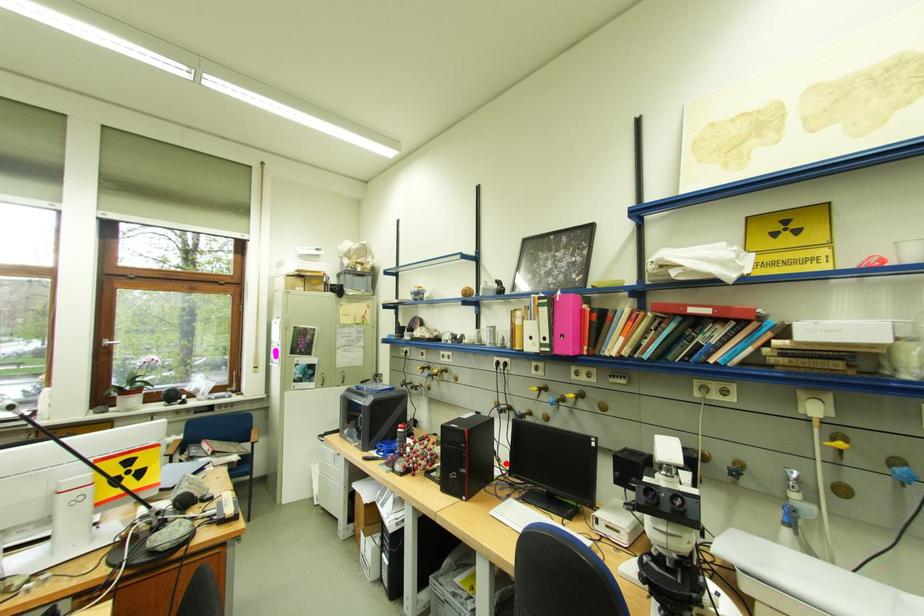
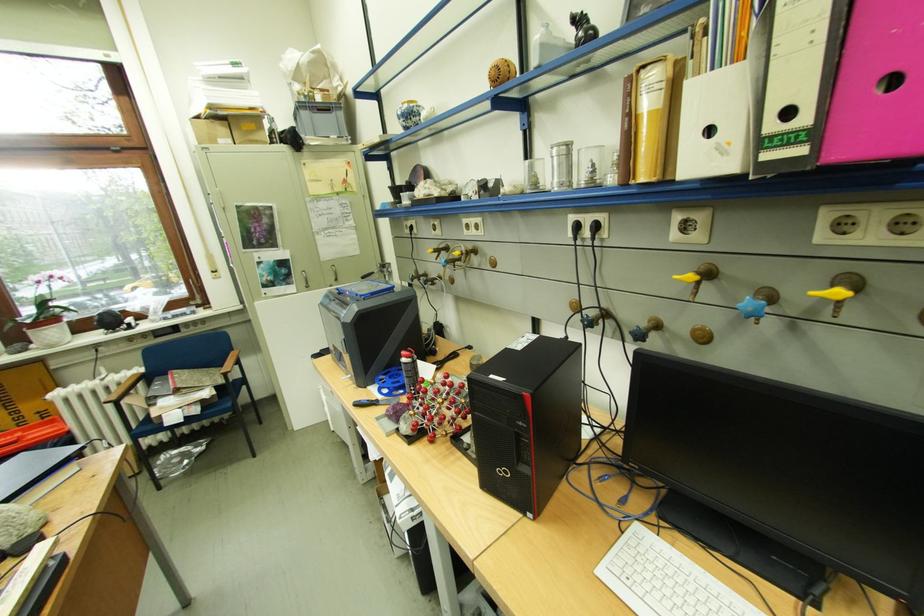
Question: I am providing you with two images of the same scene from different viewpoints. Image1 has a red point marked. In image2, the corresponding 3D location appears at what relative position? Reply with the corresponding letter.

Choices:
 (A) Closer
 (B) Farther

Answer: (A)